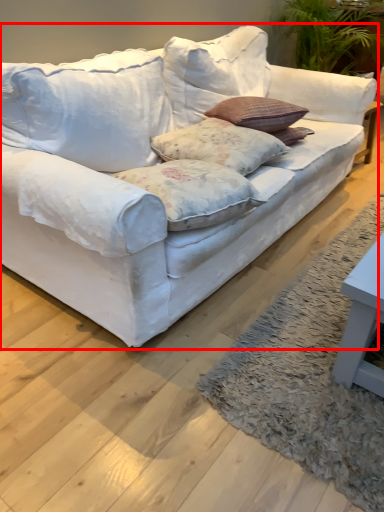
Question: From the image's perspective, where is studio couch (annotated by the red box) located in relation to pillow in the image?

Choices:
 (A) below
 (B) above

Answer: (B)